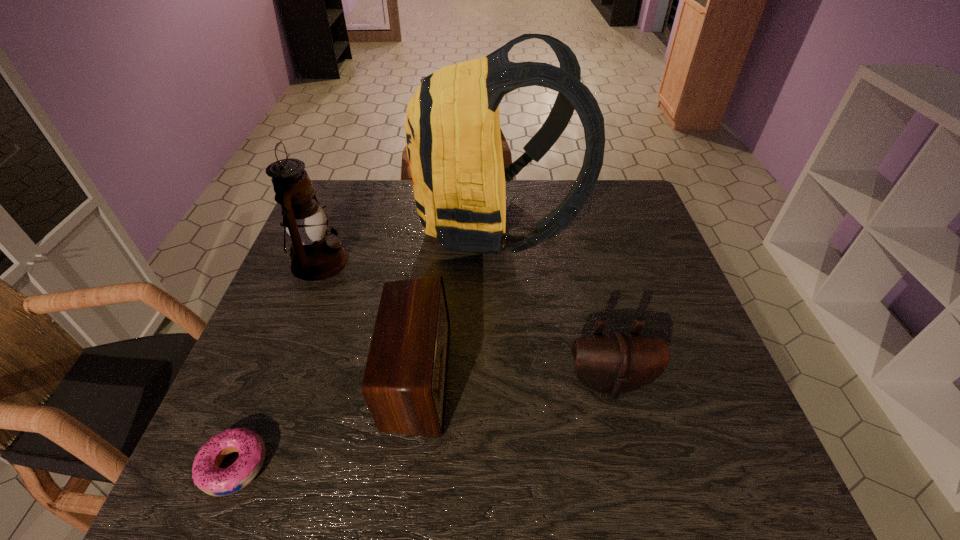
Identify the location of blank space at the left edge of the desktop. Image resolution: width=960 pixels, height=540 pixels. (296, 381).

At what (x,y) coordinates should I click in order to perform the action: click on vacant point at the right edge. Please return your answer as a coordinate pair (x, y). Looking at the image, I should click on (681, 286).

The width and height of the screenshot is (960, 540). I want to click on vacant space at the far left corner of the desktop, so click(x=355, y=222).

Where is `free space at the far right corner of the desktop`? free space at the far right corner of the desktop is located at coordinates (594, 203).

The width and height of the screenshot is (960, 540). Find the location of `empty space that is in between the backpack and the shortest object`. empty space that is in between the backpack and the shortest object is located at coordinates tap(364, 345).

Locate an element on the screen. This screenshot has width=960, height=540. vacant area between the radio receiver and the shortest object is located at coordinates (325, 421).

Identify the location of vacant point located between the pouch and the tallest object. This screenshot has width=960, height=540. (552, 302).

Identify the location of empty location between the shortest object and the radio receiver. (325, 421).

Identify the location of free space between the radio receiver and the tallest object. (455, 300).

Identify the location of vacant point located between the shortest object and the radio receiver. The width and height of the screenshot is (960, 540). (325, 421).